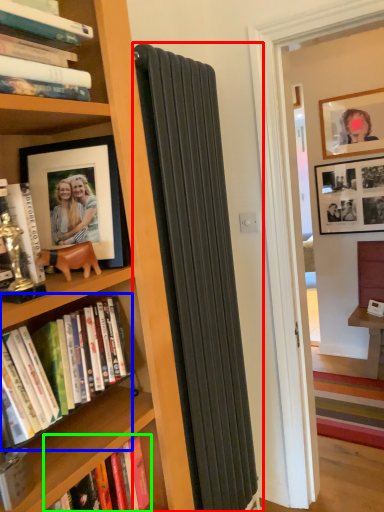
Question: Which object is the farthest from curtain (highlighted by a red box)? Choose among these: book (highlighted by a blue box) or book (highlighted by a green box).

Choices:
 (A) book
 (B) book

Answer: (B)